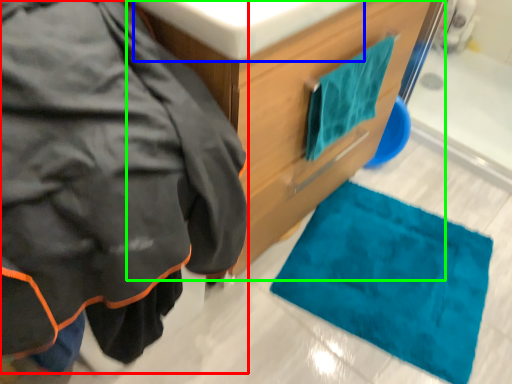
Question: Considering the real-world distances, which object is farthest from jacket (highlighted by a red box)? sink (highlighted by a blue box) or bathroom cabinet (highlighted by a green box)?

Choices:
 (A) sink
 (B) bathroom cabinet

Answer: (B)